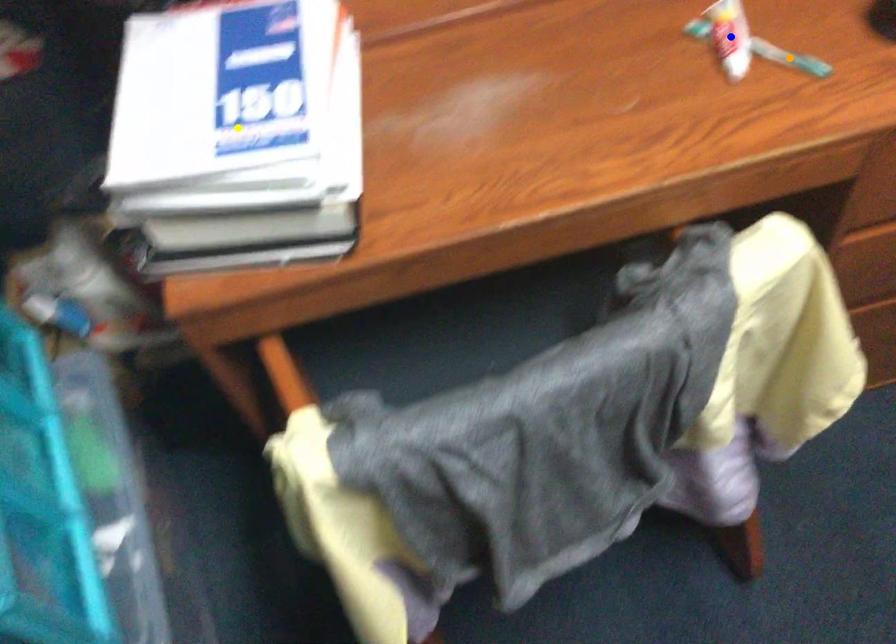
Order these from farthest to nearest:
- yellow point
- blue point
- orange point

blue point
orange point
yellow point